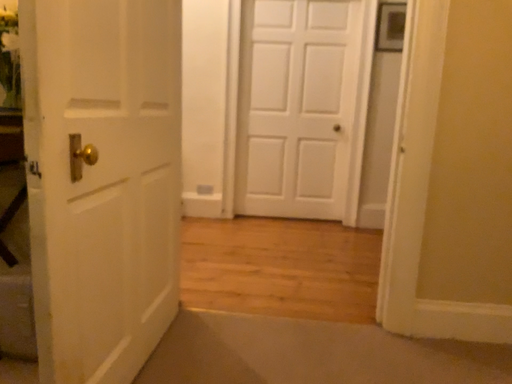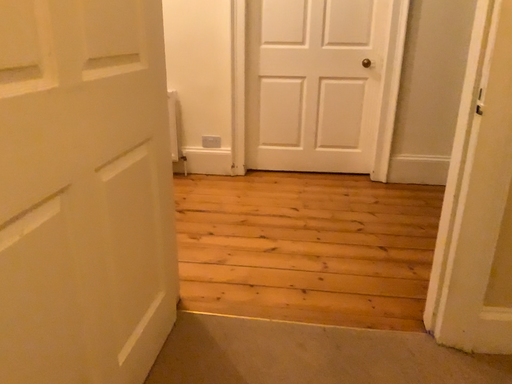
Question: Which way did the camera rotate in the video?

Choices:
 (A) rotated upward
 (B) rotated downward

Answer: (B)